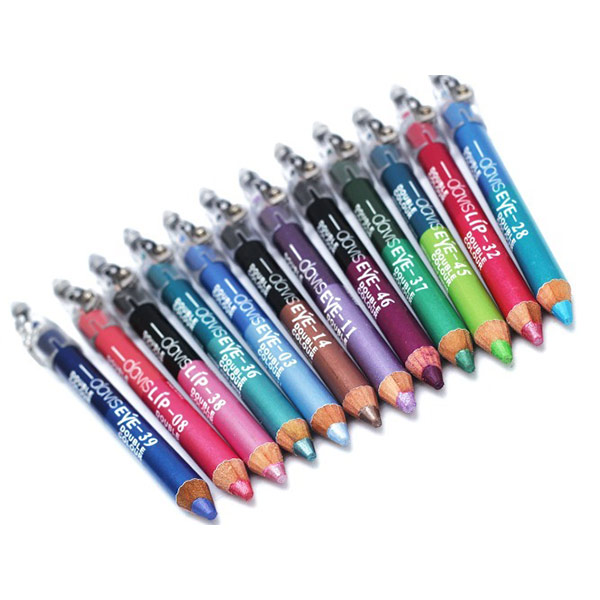
Where is `handle`? handle is located at coordinates (337, 145).